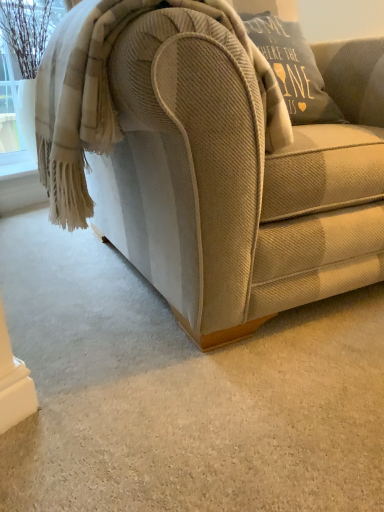
Question: In terms of width, does beige woolen blanket at upper left look wider or thinner when compared to beige corduroy couch at center?

Choices:
 (A) wide
 (B) thin

Answer: (B)

Question: Would you say beige woolen blanket at upper left is inside or outside beige corduroy couch at center?

Choices:
 (A) outside
 (B) inside

Answer: (B)

Question: Would you say beige woolen blanket at upper left is to the left or to the right of beige corduroy couch at center in the picture?

Choices:
 (A) left
 (B) right

Answer: (A)

Question: Is beige corduroy couch at center spatially inside beige woolen blanket at upper left, or outside of it?

Choices:
 (A) inside
 (B) outside

Answer: (B)

Question: In terms of size, does beige corduroy couch at center appear bigger or smaller than beige woolen blanket at upper left?

Choices:
 (A) small
 (B) big

Answer: (B)

Question: Would you say beige corduroy couch at center is to the left or to the right of beige woolen blanket at upper left in the picture?

Choices:
 (A) right
 (B) left

Answer: (A)

Question: Is beige corduroy couch at center taller or shorter than beige woolen blanket at upper left?

Choices:
 (A) short
 (B) tall

Answer: (B)